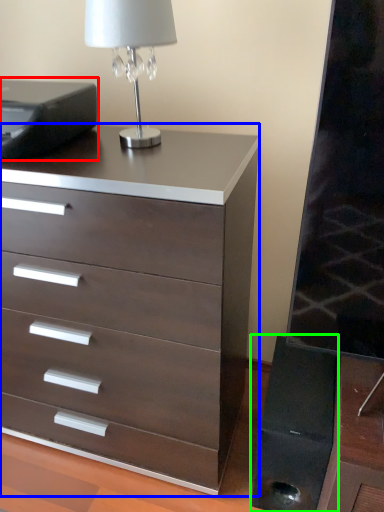
Question: Which object is the closest to the printer (highlighted by a red box)? Choose among these: chest of drawers (highlighted by a blue box) or speaker (highlighted by a green box).

Choices:
 (A) chest of drawers
 (B) speaker

Answer: (A)